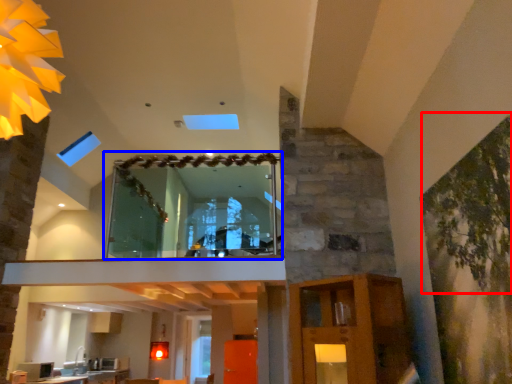
Question: Among these objects, which one is nearest to the camera, plant (highlighted by a red box) or window (highlighted by a blue box)?

Choices:
 (A) plant
 (B) window

Answer: (A)